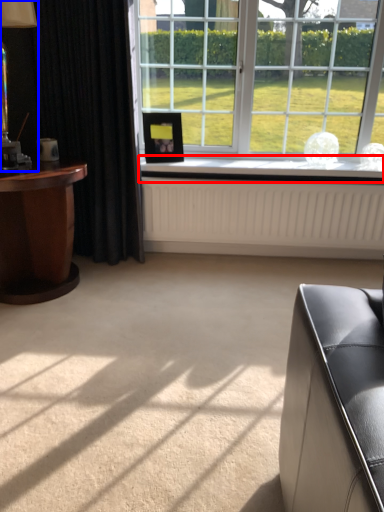
Question: Which point is further to the camera, window sill (highlighted by a red box) or table lamp (highlighted by a blue box)?

Choices:
 (A) window sill
 (B) table lamp

Answer: (A)